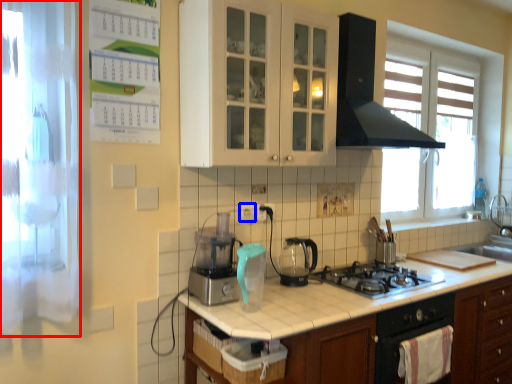
Question: Among these objects, which one is farthest to the camera, screen door (highlighted by a red box) or electric outlet (highlighted by a blue box)?

Choices:
 (A) screen door
 (B) electric outlet

Answer: (B)